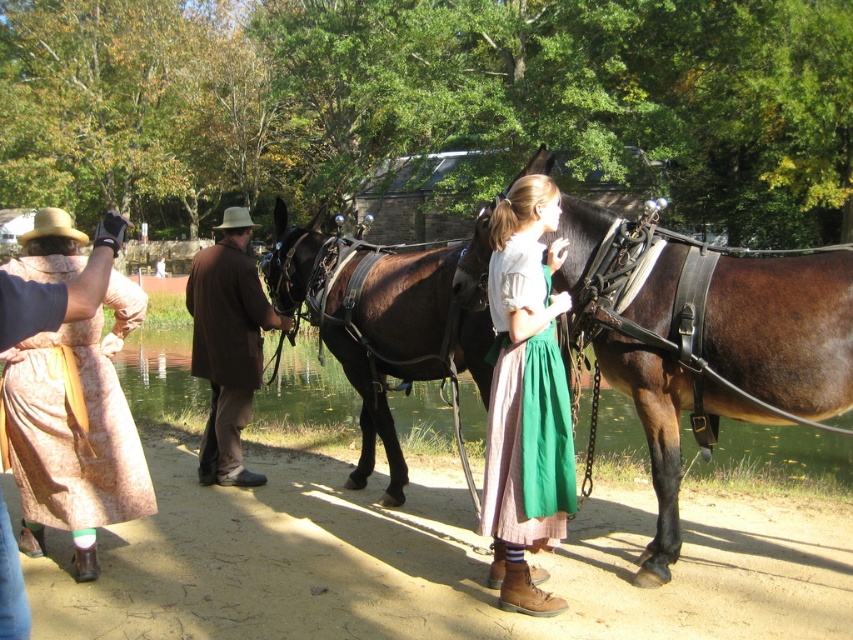
Can you confirm if green cotton skirt at center is shorter than patterned fabric dress at left?

No.

Is green cotton skirt at center bigger than patterned fabric dress at left?

Actually, green cotton skirt at center might be smaller than patterned fabric dress at left.

Find the location of `green cotton skirt at center`. green cotton skirt at center is located at coordinates (526, 397).

Does brown leather horse at center appear over patterned fabric dress at left?

Yes.

Can you confirm if brown leather horse at center is positioned below patterned fabric dress at left?

Actually, brown leather horse at center is above patterned fabric dress at left.

Between point (680, 323) and point (103, 504), which one is positioned behind?

Positioned behind is point (103, 504).

Where is `brown leather horse at center`? The height and width of the screenshot is (640, 853). brown leather horse at center is located at coordinates (782, 330).

Which of these two, patterned fabric dress at left or brown leather coach at center, stands taller?

brown leather coach at center

Is point (21, 364) closer to viewer compared to point (219, 376)?

Yes, point (21, 364) is closer to viewer.

Identify the location of patterned fabric dress at left. Image resolution: width=853 pixels, height=640 pixels. (71, 432).